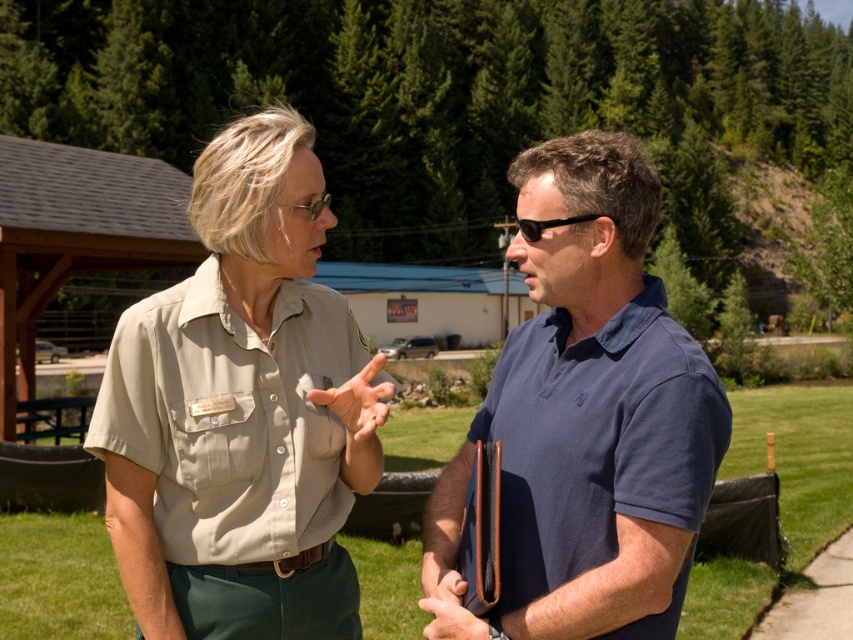
You are designing a new clothing catalog layout and want to place the matte khaki shirt at center and the blue fabric shirt at center side by side. Based on their heights, which shirt should be placed on the higher shelf to ensure they appear balanced?

The matte khaki shirt at center is taller than the blue fabric shirt at center, so placing the matte khaki shirt at center on a higher shelf will create a balanced visual arrangement.

You are a photographer trying to capture a candid shot of both the matte khaki shirt at center and the blue fabric shirt at center. Since you want to ensure both are in focus, which one should you focus on first to maximize the chances of both being clear?

You should focus on the matte khaki shirt at center first because it is in front of the blue fabric shirt at center, so focusing on the closer subject will increase the likelihood of both being in focus.